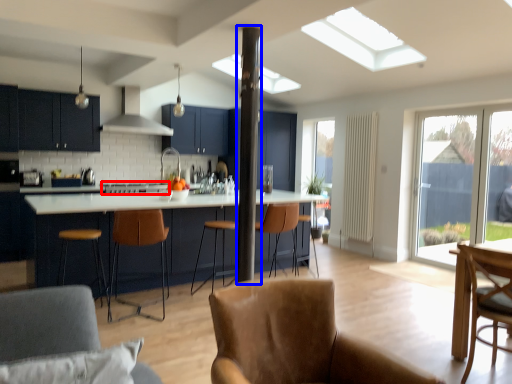
Question: Which point is further to the camera, stove (highlighted by a red box) or beam (highlighted by a blue box)?

Choices:
 (A) stove
 (B) beam

Answer: (A)